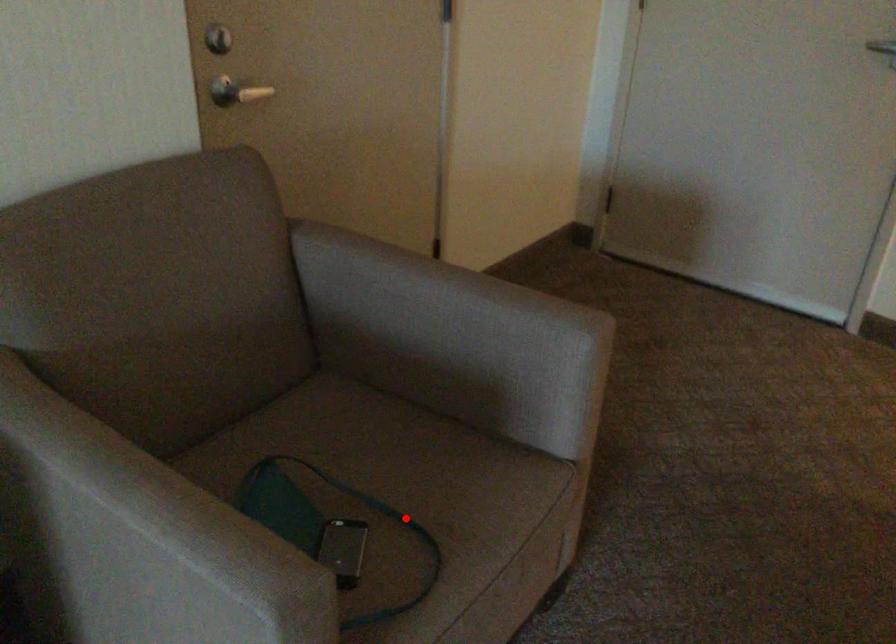
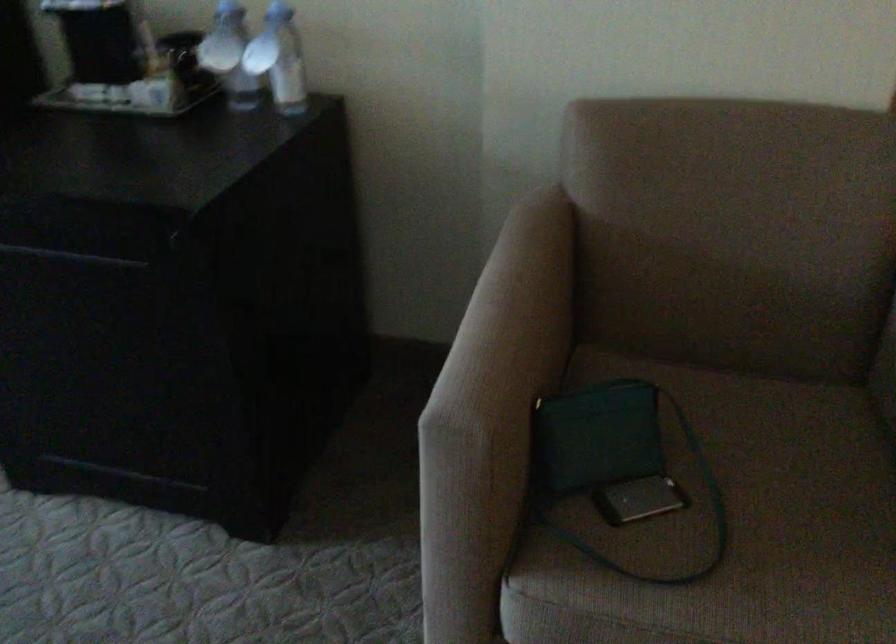
Question: A red point is marked in image1. In image2, is the corresponding 3D point closer to the camera or farther? Reply with the corresponding letter.

Choices:
 (A) The corresponding 3D point is closer.
 (B) The corresponding 3D point is farther.

Answer: (A)